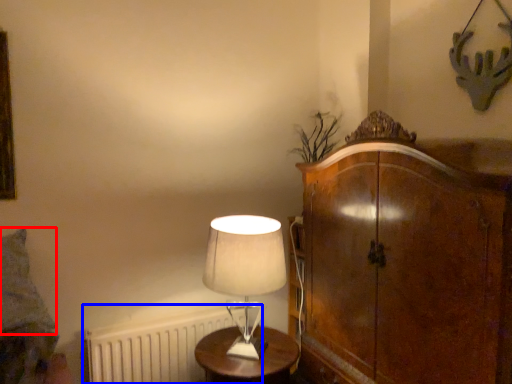
Question: Among these objects, which one is farthest to the camera, pillow (highlighted by a red box) or radiator (highlighted by a blue box)?

Choices:
 (A) pillow
 (B) radiator

Answer: (B)